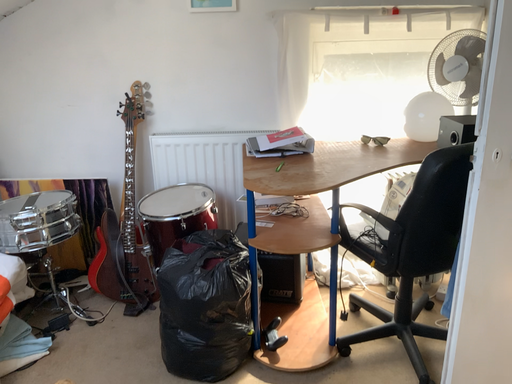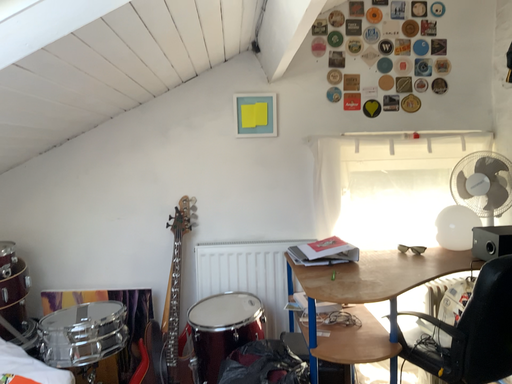
Question: Which way did the camera rotate in the video?

Choices:
 (A) rotated downward
 (B) rotated upward

Answer: (B)